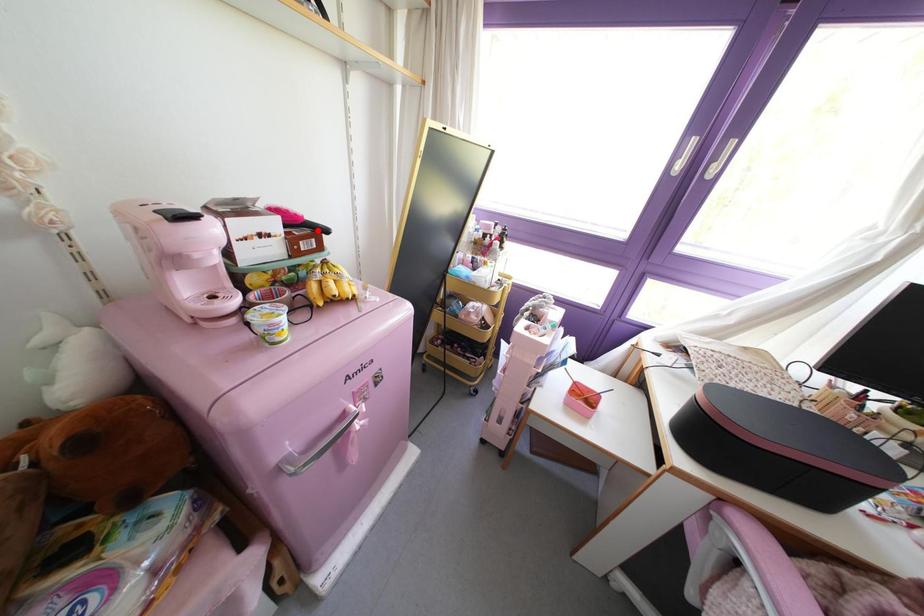
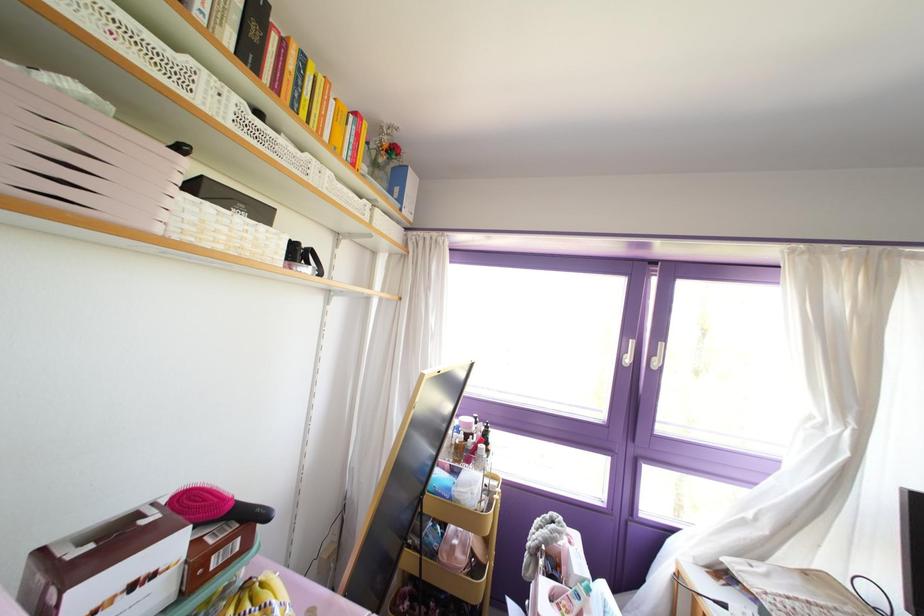
Where in the second image is the point corresponding to the highlighted location from the first image?

(251, 517)